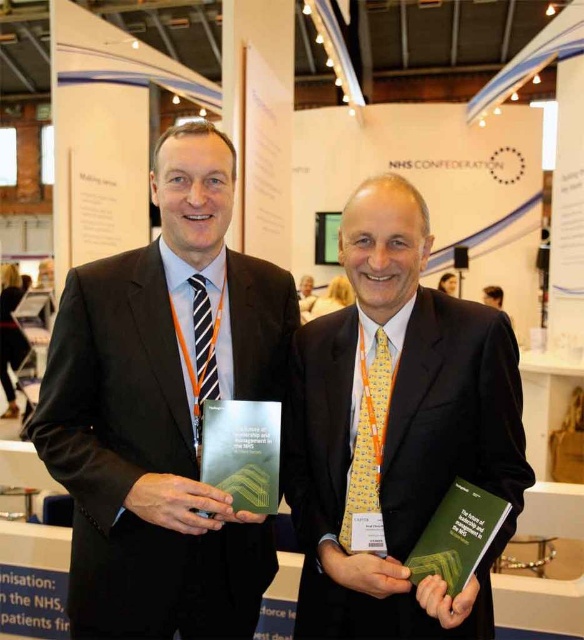
Is dark brown suit at center smaller than yellow textured tie at center?

No.

Measure the distance between dark brown suit at center and yellow textured tie at center.

They are 37.00 centimeters apart.

Which is behind, point (207, 371) or point (380, 506)?

The point (207, 371) is more distant.

This screenshot has width=584, height=640. In order to click on dark brown suit at center in this screenshot , I will do `click(164, 410)`.